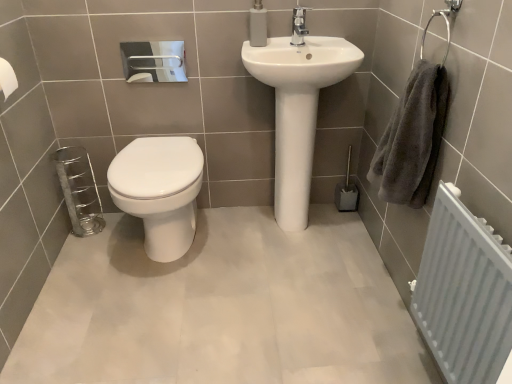
Question: Is white glossy toilet at center facing towards gray fluffy towel at right?

Choices:
 (A) no
 (B) yes

Answer: (A)

Question: From a real-world perspective, is white glossy toilet at center positioned under gray fluffy towel at right based on gravity?

Choices:
 (A) no
 (B) yes

Answer: (B)

Question: Is white glossy toilet at center positioned beyond the bounds of gray fluffy towel at right?

Choices:
 (A) no
 (B) yes

Answer: (B)

Question: Is the depth of white glossy toilet at center greater than that of gray fluffy towel at right?

Choices:
 (A) yes
 (B) no

Answer: (A)

Question: From a real-world perspective, is white glossy toilet at center over gray fluffy towel at right?

Choices:
 (A) yes
 (B) no

Answer: (B)

Question: Considering the relative sizes of white glossy toilet at center and gray fluffy towel at right in the image provided, is white glossy toilet at center wider than gray fluffy towel at right?

Choices:
 (A) no
 (B) yes

Answer: (B)

Question: Can you confirm if white textured radiator at right is wider than white matte toilet paper at left?

Choices:
 (A) yes
 (B) no

Answer: (A)

Question: Is white textured radiator at right turned away from white matte toilet paper at left?

Choices:
 (A) yes
 (B) no

Answer: (B)

Question: Is white textured radiator at right shorter than white matte toilet paper at left?

Choices:
 (A) no
 (B) yes

Answer: (A)

Question: Is white textured radiator at right further to camera compared to white matte toilet paper at left?

Choices:
 (A) no
 (B) yes

Answer: (A)

Question: Is white matte toilet paper at left inside white textured radiator at right?

Choices:
 (A) yes
 (B) no

Answer: (B)

Question: Does white textured radiator at right have a lesser width compared to white matte toilet paper at left?

Choices:
 (A) no
 (B) yes

Answer: (A)

Question: Is the depth of white glossy sink at center less than that of white textured radiator at right?

Choices:
 (A) no
 (B) yes

Answer: (A)